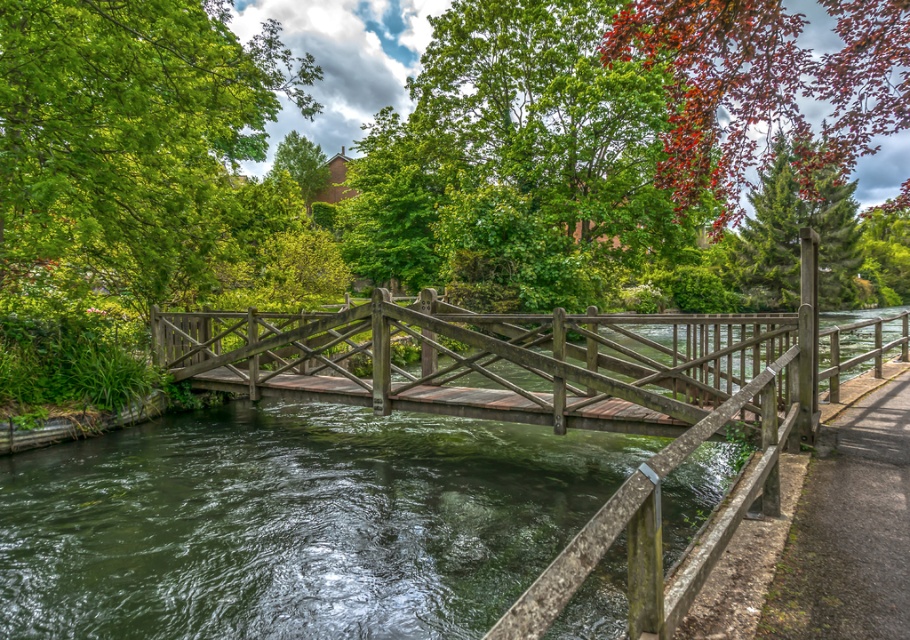
Which is in front, point (476, 497) or point (683, 406)?

Point (683, 406) is in front.

Who is more forward, (322, 506) or (476, 314)?

Point (322, 506) is more forward.

The width and height of the screenshot is (910, 640). In order to click on green mossy water at center in this screenshot , I will do `click(292, 522)`.

Is green mossy water at center taller than brown wooden path at lower right?

Yes, green mossy water at center is taller than brown wooden path at lower right.

Which of these two, green mossy water at center or brown wooden path at lower right, stands shorter?

brown wooden path at lower right

Find the location of a particular element. green mossy water at center is located at coordinates (292, 522).

Does wooden bridge at center appear over reddish-brown bark tree at upper right?

Actually, wooden bridge at center is below reddish-brown bark tree at upper right.

Between point (595, 374) and point (740, 17), which one is positioned in front?

Point (595, 374) is more forward.

Locate an element on the screen. The image size is (910, 640). wooden bridge at center is located at coordinates (522, 362).

Where is `wooden bridge at center`? The image size is (910, 640). wooden bridge at center is located at coordinates (522, 362).